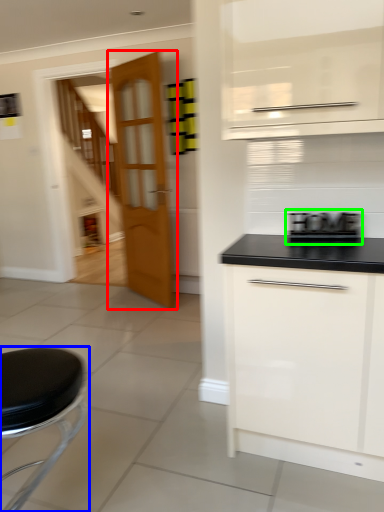
Question: Considering the real-world distances, which object is closest to door (highlighted by a red box)? furniture (highlighted by a blue box) or appliance (highlighted by a green box).

Choices:
 (A) furniture
 (B) appliance

Answer: (B)